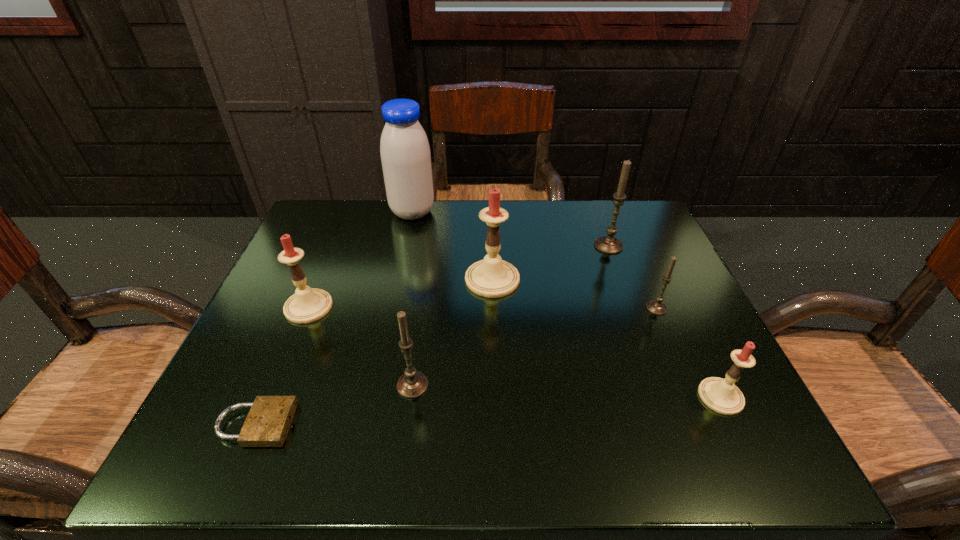
Locate an element on the screen. the smallest gray candle is located at coordinates (656, 306).

At what (x,y) coordinates should I click in order to perform the action: click on the smallest red candle. Please return your answer as a coordinate pair (x, y). The height and width of the screenshot is (540, 960). Looking at the image, I should click on (721, 395).

Identify the location of the rightmost red candle. This screenshot has width=960, height=540. (721, 395).

I want to click on padlock, so click(x=267, y=424).

Where is `free space located 0.260m on the right of the blue soya milk`? This screenshot has width=960, height=540. free space located 0.260m on the right of the blue soya milk is located at coordinates (532, 212).

Where is `free space located 0.110m on the front of the seventh nearest object`? Image resolution: width=960 pixels, height=540 pixels. free space located 0.110m on the front of the seventh nearest object is located at coordinates coord(623,286).

Locate an element on the screen. The image size is (960, 540). blank area located 0.220m on the right of the fourth object from right to left is located at coordinates (619, 279).

Where is `free space located on the right of the second smallest red candle`? This screenshot has height=540, width=960. free space located on the right of the second smallest red candle is located at coordinates (385, 307).

I want to click on vacant point located on the right of the fifth candle from right to left, so click(602, 385).

Locate an element on the screen. The height and width of the screenshot is (540, 960). free space located 0.350m on the back of the second farthest gray candle is located at coordinates (615, 211).